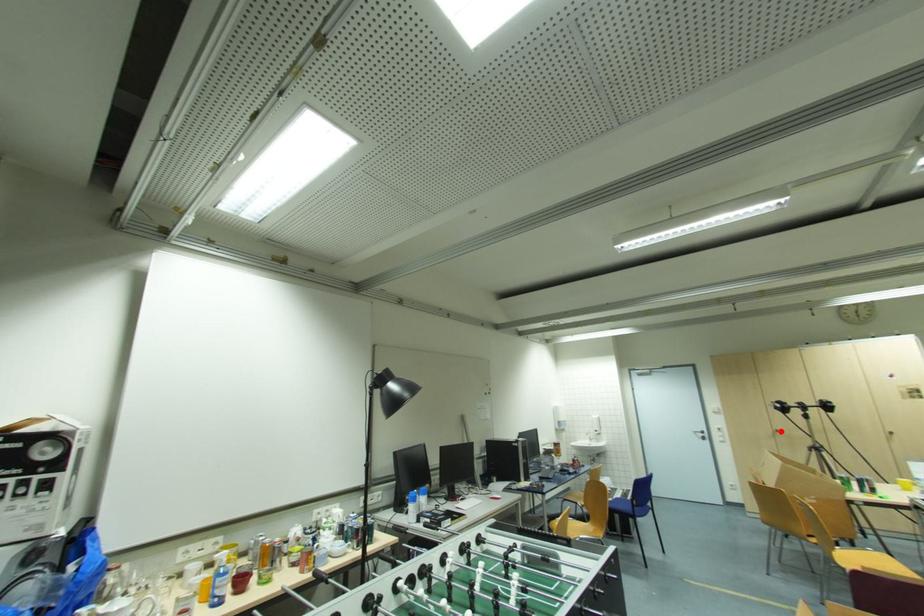
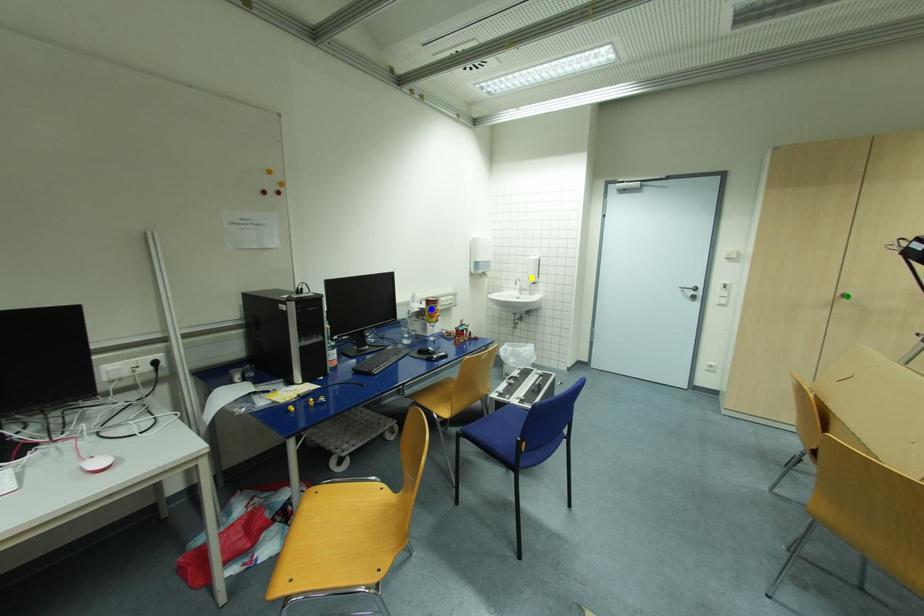
Question: I am providing you with two images of the same scene from different viewpoints. A red point is marked on the first image. You are given multiple points on the second image. Can you choose the point in image 2 that corresponds to the point in image 1?

Choices:
 (A) yellow point
 (B) blue point
 (C) green point

Answer: (C)